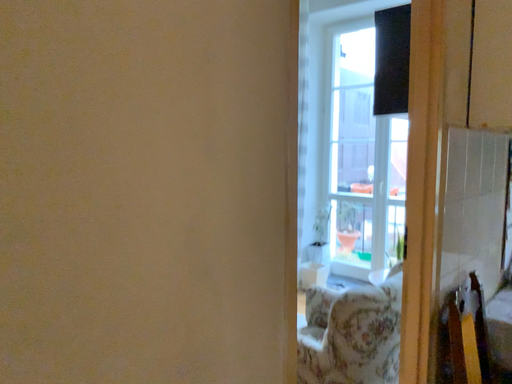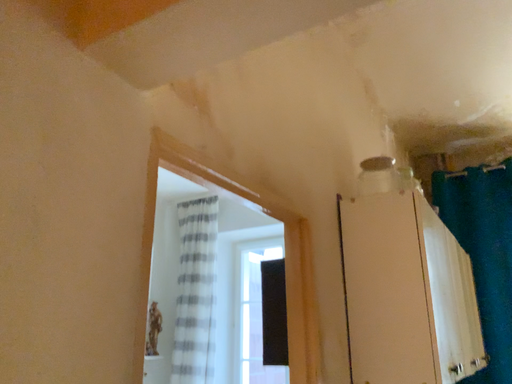
Question: How did the camera likely rotate when shooting the video?

Choices:
 (A) rotated downward
 (B) rotated upward

Answer: (B)